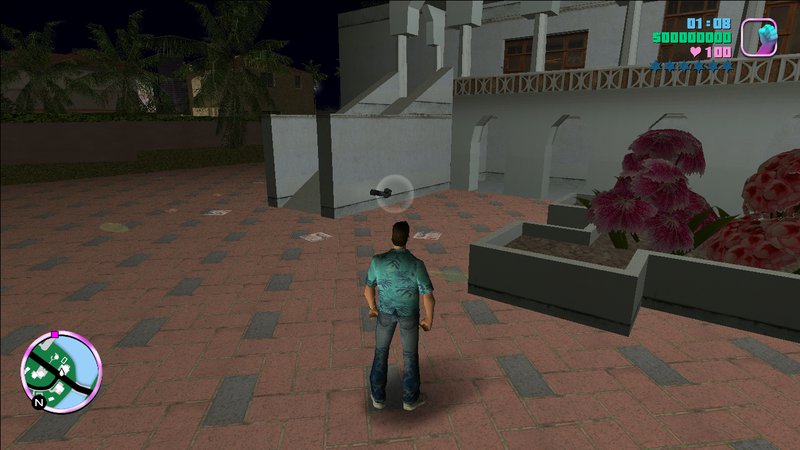
What are the coordinates of `leftmost arch opening` in the screenshot? It's located at (488, 153).